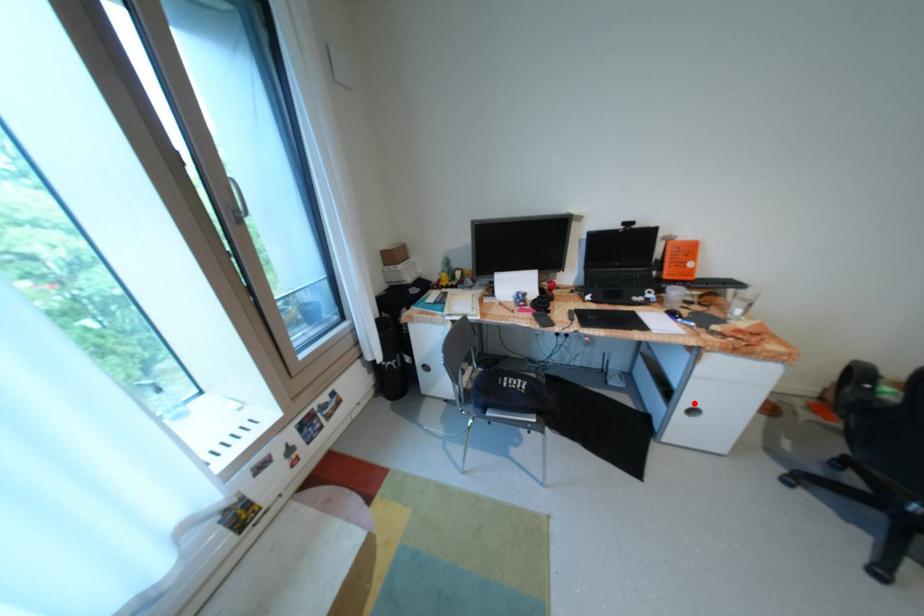
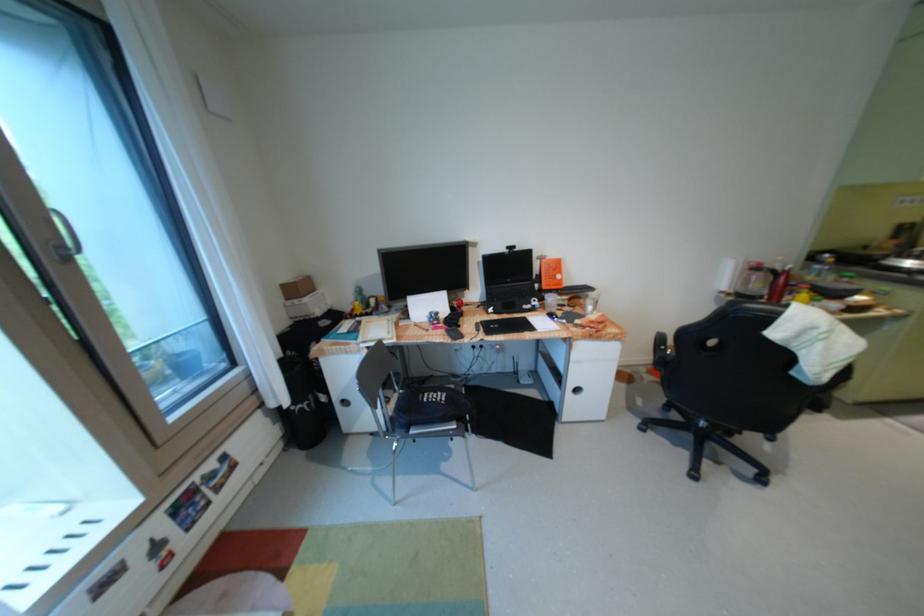
Question: A red point is marked in image1. In image2, is the corresponding 3D point closer to the camera or farther? Reply with the corresponding letter.

Choices:
 (A) The corresponding 3D point is closer.
 (B) The corresponding 3D point is farther.

Answer: (B)